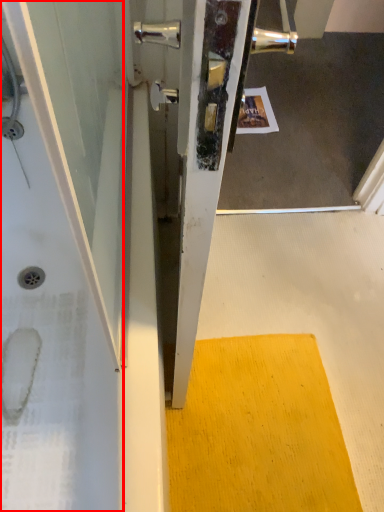
Question: From the image's perspective, where is bath (annotated by the red box) located relative to doormat?

Choices:
 (A) above
 (B) below

Answer: (A)